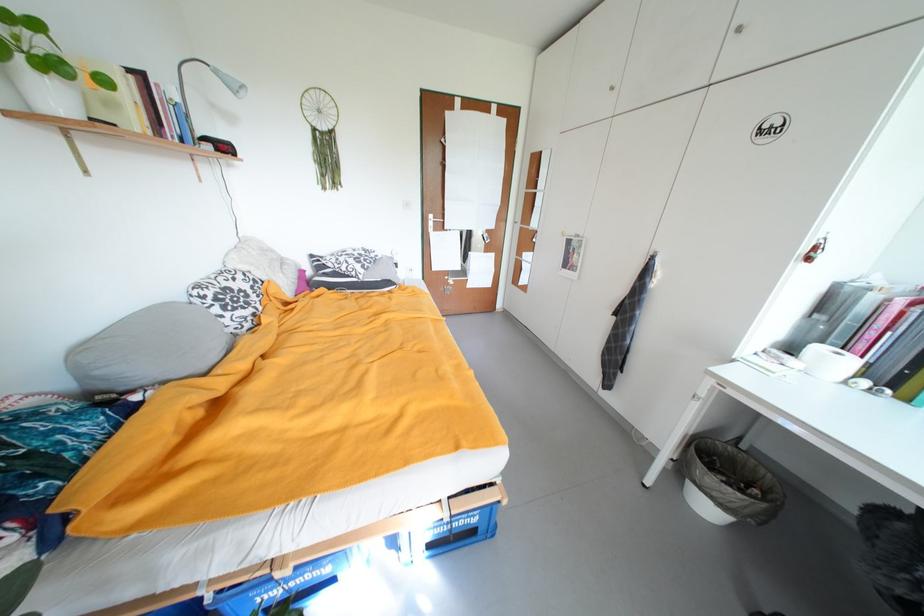
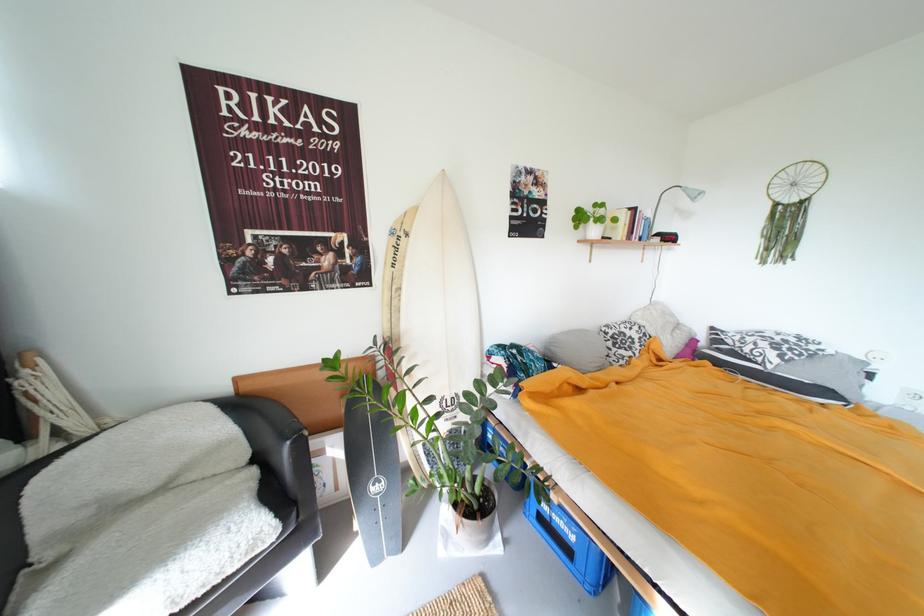
Find the pixel in the second image that matches [211,299] in the first image.

(614, 334)